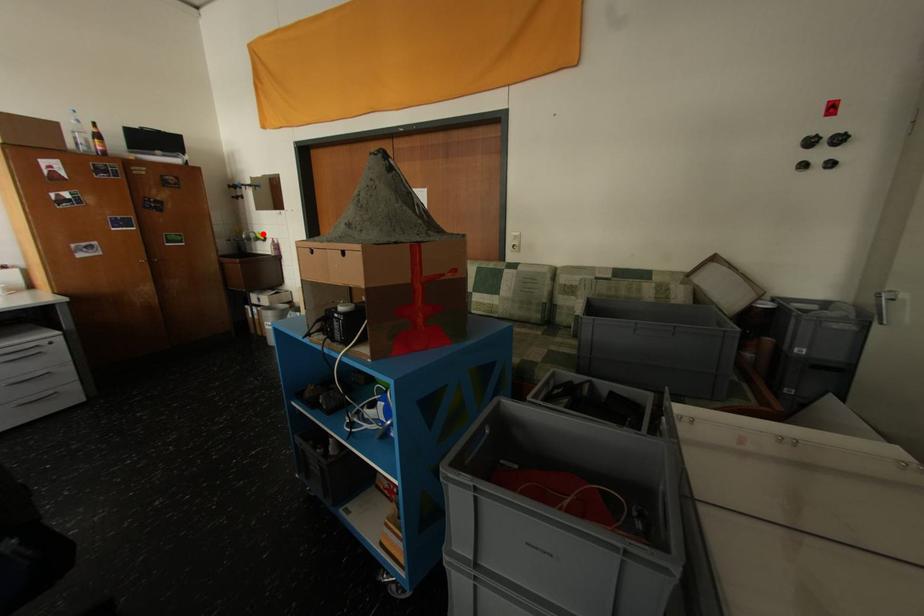
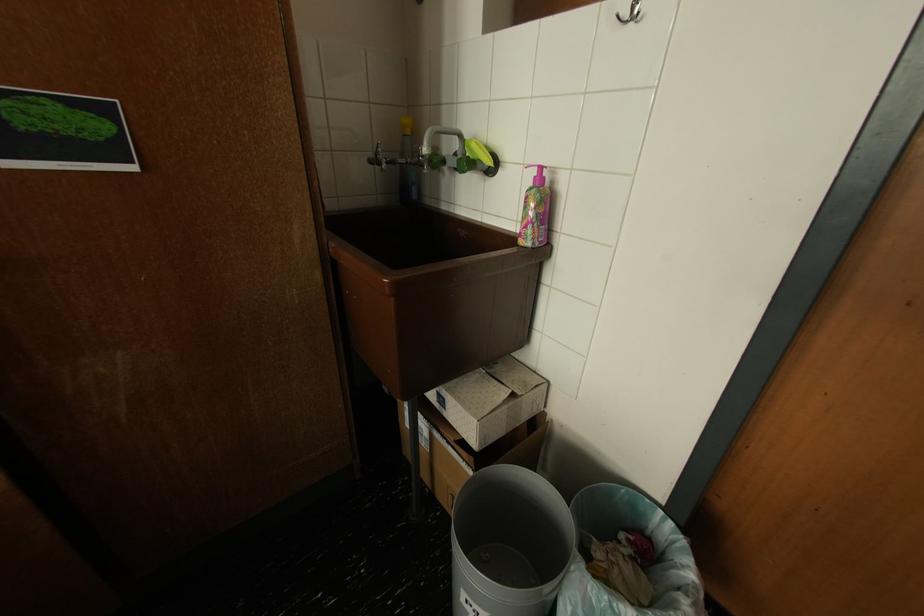
Where in the second image is the point corresponding to the highlighted location from the first image?

(468, 138)